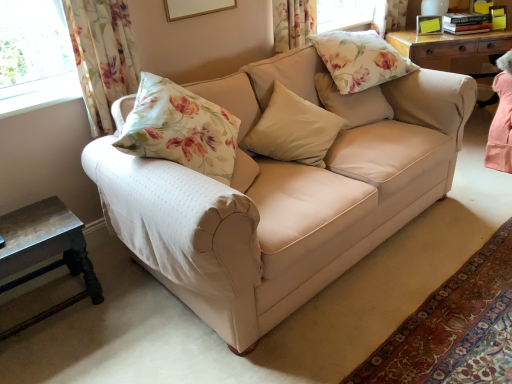
Question: Does rustic wood side table at lower left have a larger size compared to beige fabric couch at center?

Choices:
 (A) no
 (B) yes

Answer: (A)

Question: Is rustic wood side table at lower left further to the viewer compared to beige fabric couch at center?

Choices:
 (A) yes
 (B) no

Answer: (A)

Question: Considering the relative sizes of rustic wood side table at lower left and beige fabric couch at center in the image provided, is rustic wood side table at lower left smaller than beige fabric couch at center?

Choices:
 (A) no
 (B) yes

Answer: (B)

Question: From a real-world perspective, is rustic wood side table at lower left on top of beige fabric couch at center?

Choices:
 (A) no
 (B) yes

Answer: (A)

Question: Can you confirm if rustic wood side table at lower left is positioned to the right of beige fabric couch at center?

Choices:
 (A) yes
 (B) no

Answer: (B)

Question: In the image, is beige fabric pillow at center, placed as the 3th pillow when sorted from top to bottom, positioned in front of or behind floral fabric curtain at upper left?

Choices:
 (A) behind
 (B) front

Answer: (A)

Question: Is beige fabric pillow at center, placed as the 3th pillow when sorted from top to bottom, wider or thinner than floral fabric curtain at upper left?

Choices:
 (A) thin
 (B) wide

Answer: (B)

Question: In terms of height, does beige fabric pillow at center, placed as the 3th pillow when sorted from top to bottom, look taller or shorter compared to floral fabric curtain at upper left?

Choices:
 (A) short
 (B) tall

Answer: (A)

Question: From a real-world perspective, is beige fabric pillow at center, arranged as the first pillow when ordered from the bottom, positioned above or below floral fabric curtain at upper left?

Choices:
 (A) below
 (B) above

Answer: (A)

Question: Choose the correct answer: Is beige fabric couch at center inside floral fabric curtain at upper left or outside it?

Choices:
 (A) inside
 (B) outside

Answer: (B)

Question: Is beige fabric couch at center in front of or behind floral fabric curtain at upper left in the image?

Choices:
 (A) front
 (B) behind

Answer: (A)

Question: From a real-world perspective, relative to floral fabric curtain at upper left, is beige fabric couch at center vertically above or below?

Choices:
 (A) below
 (B) above

Answer: (A)

Question: From their relative heights in the image, would you say beige fabric couch at center is taller or shorter than floral fabric curtain at upper left?

Choices:
 (A) short
 (B) tall

Answer: (B)

Question: Is rustic wood side table at lower left situated inside beige fabric couch at center or outside?

Choices:
 (A) outside
 (B) inside

Answer: (A)

Question: Visually, is rustic wood side table at lower left positioned to the left or to the right of beige fabric couch at center?

Choices:
 (A) left
 (B) right

Answer: (A)